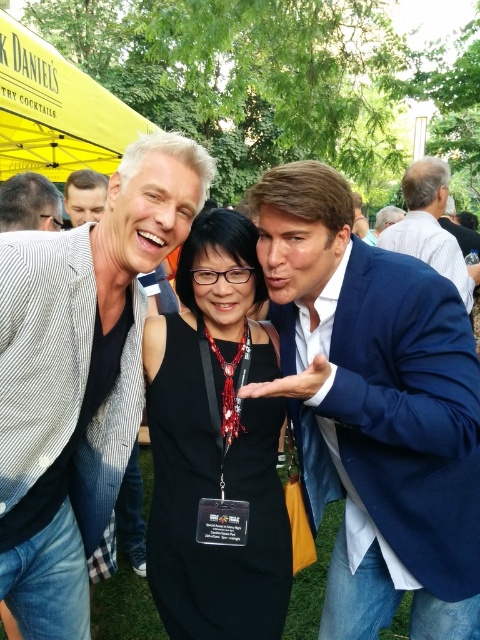
Is blue satin suit at center to the right of yellow fabric canopy at upper left from the viewer's perspective?

Yes, blue satin suit at center is to the right of yellow fabric canopy at upper left.

Does blue satin suit at center have a greater height compared to yellow fabric canopy at upper left?

Yes.

Between point (332, 244) and point (82, 140), which one is positioned behind?

The point (82, 140) is behind.

Where is `blue satin suit at center`? The width and height of the screenshot is (480, 640). blue satin suit at center is located at coordinates [374, 408].

Is point (59, 208) behind point (86, 221)?

That is True.

Is matte black shirt at left smaller than matte black hair at upper left?

Result: Yes.

The image size is (480, 640). Describe the element at coordinates (29, 204) in the screenshot. I see `matte black shirt at left` at that location.

At what (x,y) coordinates should I click in order to perform the action: click on matte black shirt at left. Please return your answer as a coordinate pair (x, y). The height and width of the screenshot is (640, 480). Looking at the image, I should click on (29, 204).

Does yellow fabric canopy at upper left have a smaller size compared to matte black shirt at left?

No, yellow fabric canopy at upper left is not smaller than matte black shirt at left.

Can you confirm if yellow fabric canopy at upper left is positioned below matte black shirt at left?

No.

Where is `yellow fabric canopy at upper left`? yellow fabric canopy at upper left is located at coordinates tap(56, 112).